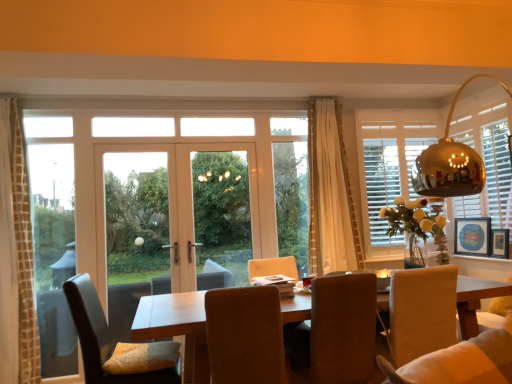
Question: From a real-world perspective, is clear glass door at center located higher than clear glass window at left?

Choices:
 (A) yes
 (B) no

Answer: (B)

Question: Is clear glass door at center positioned behind clear glass window at left?

Choices:
 (A) yes
 (B) no

Answer: (A)

Question: Is clear glass door at center closer to camera compared to clear glass window at left?

Choices:
 (A) no
 (B) yes

Answer: (A)

Question: Would you say clear glass door at center is a long distance from clear glass window at left?

Choices:
 (A) no
 (B) yes

Answer: (A)

Question: Is clear glass door at center facing towards clear glass window at left?

Choices:
 (A) yes
 (B) no

Answer: (B)

Question: Considering the relative sizes of clear glass door at center and clear glass window at left in the image provided, is clear glass door at center thinner than clear glass window at left?

Choices:
 (A) yes
 (B) no

Answer: (B)

Question: Is clear glass door at center far from white wood screen door at center?

Choices:
 (A) yes
 (B) no

Answer: (B)

Question: From the image's perspective, is clear glass door at center under white wood screen door at center?

Choices:
 (A) yes
 (B) no

Answer: (A)

Question: Considering the relative sizes of clear glass door at center and white wood screen door at center in the image provided, is clear glass door at center thinner than white wood screen door at center?

Choices:
 (A) no
 (B) yes

Answer: (A)

Question: From a real-world perspective, is clear glass door at center located beneath white wood screen door at center?

Choices:
 (A) no
 (B) yes

Answer: (B)

Question: Is clear glass door at center smaller than white wood screen door at center?

Choices:
 (A) no
 (B) yes

Answer: (A)

Question: Is clear glass door at center to the right of white wood screen door at center from the viewer's perspective?

Choices:
 (A) yes
 (B) no

Answer: (B)

Question: Can you confirm if clear glass window at left is thinner than wooden picture frame at right, placed as the 2th picture frame when sorted from back to front?

Choices:
 (A) no
 (B) yes

Answer: (B)